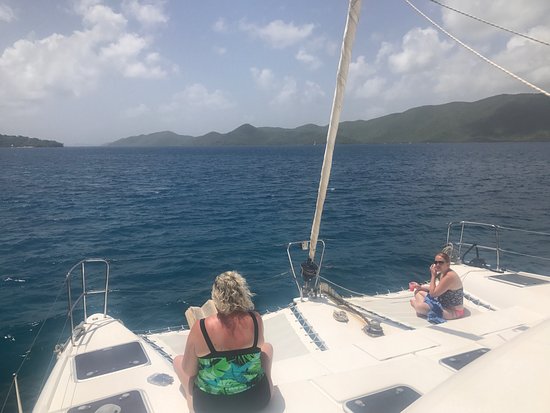
Where is `book`? book is located at coordinates (201, 312).